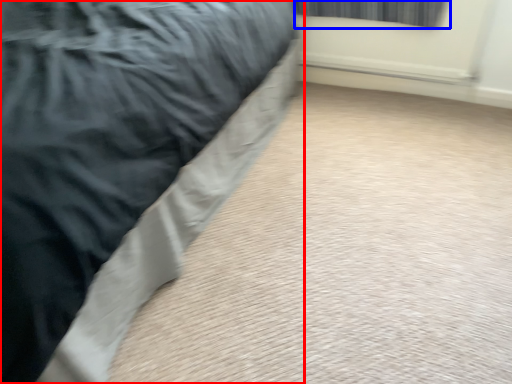
Question: Among these objects, which one is nearest to the camera, bed (highlighted by a red box) or curtain (highlighted by a blue box)?

Choices:
 (A) bed
 (B) curtain

Answer: (A)